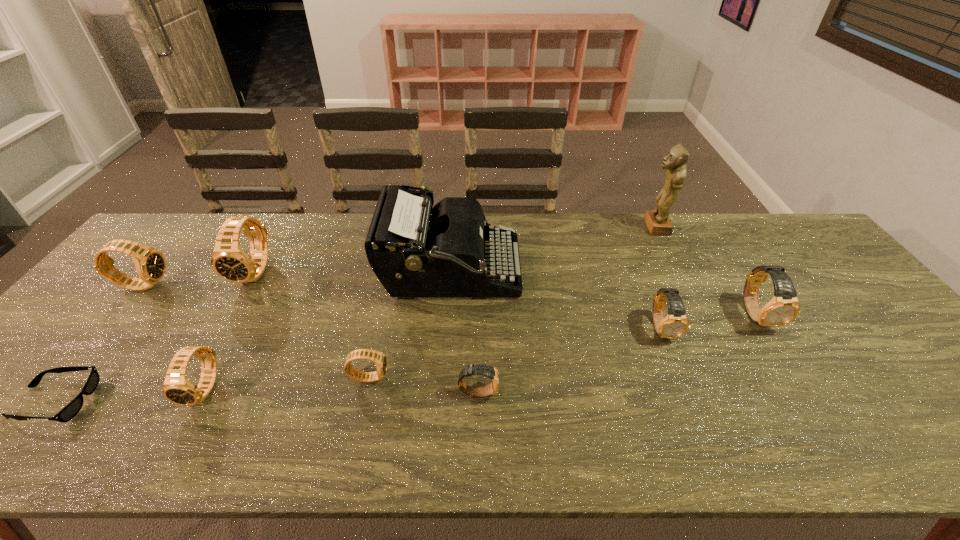
Where is `the tallest object`? This screenshot has width=960, height=540. the tallest object is located at coordinates (657, 221).

Image resolution: width=960 pixels, height=540 pixels. I want to click on the second object from right to left, so pos(657,221).

Identify the location of typewriter. (413, 254).

Locate an element on the screen. The width and height of the screenshot is (960, 540). the tallest watch is located at coordinates (229, 260).

Identify the location of the third tallest object. (229, 260).

At what (x,y) coordinates should I click in order to perform the action: click on the leftmost black watch. Please return your answer as a coordinate pair (x, y). The image size is (960, 540). Looking at the image, I should click on (150, 264).

Image resolution: width=960 pixels, height=540 pixels. I want to click on the third smallest black watch, so click(x=150, y=264).

This screenshot has width=960, height=540. I want to click on the rightmost object, so click(784, 307).

Image resolution: width=960 pixels, height=540 pixels. In order to click on the biggest gold watch in this screenshot , I will do `click(784, 307)`.

Image resolution: width=960 pixels, height=540 pixels. Identify the location of the third biggest black watch. (177, 388).